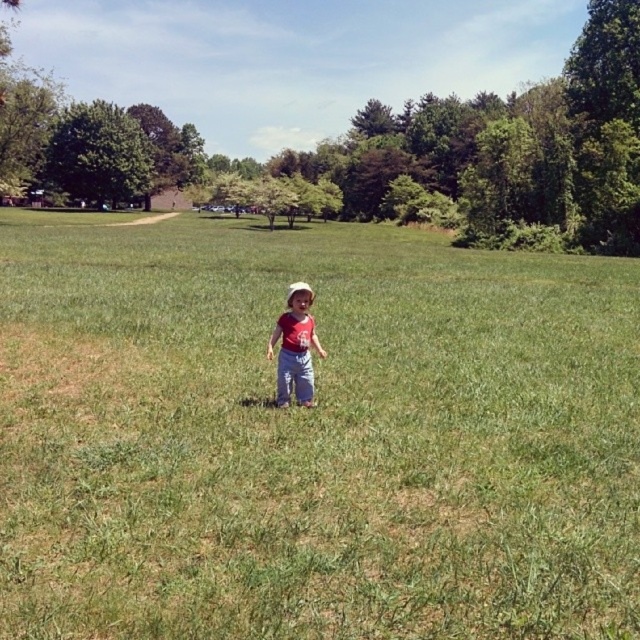
Between green grass at center and matte red shirt at center, which one appears on the right side from the viewer's perspective?

green grass at center

Does point (200, 264) lie behind point (308, 384)?

Yes, point (200, 264) is behind point (308, 384).

You are a GUI agent. You are given a task and a screenshot of the screen. Output one action in this format:
    pyautogui.click(x=<x>, y=<y>)
    Task: Click on the green grass at center
    This screenshot has width=640, height=640.
    Given the screenshot: What is the action you would take?
    pyautogui.click(x=312, y=435)